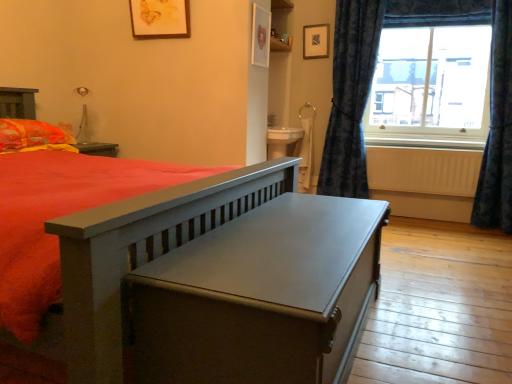
Question: Is white painted wood at right aimed at blue textured curtain at right, the first curtain viewed from the left?

Choices:
 (A) no
 (B) yes

Answer: (A)

Question: Is white painted wood at right outside of blue textured curtain at right, the second curtain viewed from the right?

Choices:
 (A) yes
 (B) no

Answer: (A)

Question: Considering the relative sizes of white painted wood at right and blue textured curtain at right, the first curtain viewed from the left, in the image provided, is white painted wood at right bigger than blue textured curtain at right, the first curtain viewed from the left,?

Choices:
 (A) no
 (B) yes

Answer: (A)

Question: Is white painted wood at right positioned with its back to blue textured curtain at right, the first curtain viewed from the left?

Choices:
 (A) no
 (B) yes

Answer: (A)

Question: Can you confirm if white painted wood at right is smaller than blue textured curtain at right, the second curtain viewed from the right?

Choices:
 (A) yes
 (B) no

Answer: (A)

Question: From a real-world perspective, is white painted wood at right above or below orange/yellow fabric pillow at left?

Choices:
 (A) below
 (B) above

Answer: (A)

Question: Is white painted wood at right taller or shorter than orange/yellow fabric pillow at left?

Choices:
 (A) tall
 (B) short

Answer: (B)

Question: From the image's perspective, is white painted wood at right located above or below orange/yellow fabric pillow at left?

Choices:
 (A) below
 (B) above

Answer: (B)

Question: Is white painted wood at right wider or thinner than orange/yellow fabric pillow at left?

Choices:
 (A) wide
 (B) thin

Answer: (B)

Question: From the image's perspective, relative to orange/yellow fabric pillow at left, is clear glass window at upper right above or below?

Choices:
 (A) below
 (B) above

Answer: (B)

Question: From a real-world perspective, relative to orange/yellow fabric pillow at left, is clear glass window at upper right vertically above or below?

Choices:
 (A) above
 (B) below

Answer: (A)

Question: Based on their positions, is clear glass window at upper right located to the left or right of orange/yellow fabric pillow at left?

Choices:
 (A) left
 (B) right

Answer: (B)

Question: Is clear glass window at upper right situated inside orange/yellow fabric pillow at left or outside?

Choices:
 (A) outside
 (B) inside

Answer: (A)

Question: From a real-world perspective, relative to white painted wood at right, is matte gray table at center vertically above or below?

Choices:
 (A) below
 (B) above

Answer: (A)

Question: From their relative heights in the image, would you say matte gray table at center is taller or shorter than white painted wood at right?

Choices:
 (A) short
 (B) tall

Answer: (B)